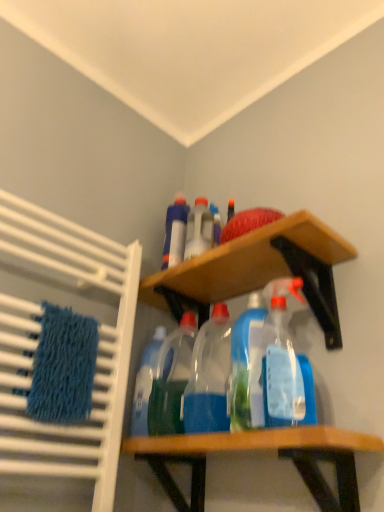
Question: Would you say wooden shelf at upper center, the second shelf from the bottom, is a long distance from translucent plastic spray bottle at center, placed as the second cleaning product when sorted from right to left?

Choices:
 (A) no
 (B) yes

Answer: (A)

Question: From the image's perspective, is wooden shelf at upper center, the 1th shelf in the top-to-bottom sequence, below translucent plastic spray bottle at center, placed as the second cleaning product when sorted from right to left?

Choices:
 (A) no
 (B) yes

Answer: (A)

Question: Is translucent plastic spray bottle at center, placed as the second cleaning product when sorted from right to left, completely or partially inside wooden shelf at upper center, the second shelf from the bottom?

Choices:
 (A) no
 (B) yes

Answer: (B)

Question: From a real-world perspective, is wooden shelf at upper center, the 1th shelf in the top-to-bottom sequence, under translucent plastic spray bottle at center, placed as the second cleaning product when sorted from right to left?

Choices:
 (A) yes
 (B) no

Answer: (B)

Question: Is wooden shelf at upper center, the 1th shelf in the top-to-bottom sequence, at the left side of translucent plastic spray bottle at center, placed as the second cleaning product when sorted from right to left?

Choices:
 (A) yes
 (B) no

Answer: (A)

Question: Looking at their shapes, would you say wooden shelf at upper center, the 1th shelf in the top-to-bottom sequence, is wider or thinner than transparent plastic bottles at center, positioned as the fourth bottle in back-to-front order?

Choices:
 (A) wide
 (B) thin

Answer: (A)

Question: Which is correct: wooden shelf at upper center, the 1th shelf in the top-to-bottom sequence, is inside transparent plastic bottles at center, which appears as the first bottle when viewed from the front, or outside of it?

Choices:
 (A) outside
 (B) inside

Answer: (A)

Question: From the image's perspective, relative to transparent plastic bottles at center, which appears as the first bottle when viewed from the front, is wooden shelf at upper center, the second shelf from the bottom, above or below?

Choices:
 (A) below
 (B) above

Answer: (B)

Question: Based on their positions, is wooden shelf at upper center, the 1th shelf in the top-to-bottom sequence, located to the left or right of transparent plastic bottles at center, which appears as the first bottle when viewed from the front?

Choices:
 (A) right
 (B) left

Answer: (A)

Question: From the image's perspective, relative to wooden shelf at center, the first shelf positioned from the bottom, is transparent plastic spray bottle at center, the first cleaning product when ordered from right to left, above or below?

Choices:
 (A) above
 (B) below

Answer: (A)

Question: In terms of height, does transparent plastic spray bottle at center, the 2th cleaning product viewed from the left, look taller or shorter compared to wooden shelf at center, acting as the 2th shelf starting from the top?

Choices:
 (A) short
 (B) tall

Answer: (B)

Question: In the image, is transparent plastic spray bottle at center, the 2th cleaning product viewed from the left, positioned in front of or behind wooden shelf at center, the first shelf positioned from the bottom?

Choices:
 (A) behind
 (B) front

Answer: (A)

Question: Does point (273, 318) appear closer or farther from the camera than point (316, 436)?

Choices:
 (A) farther
 (B) closer

Answer: (A)

Question: From their relative heights in the image, would you say transparent plastic spray bottle at center, the first cleaning product when ordered from right to left, is taller or shorter than transparent plastic bottles at center, positioned as the fourth bottle in back-to-front order?

Choices:
 (A) tall
 (B) short

Answer: (A)

Question: Relative to transparent plastic bottles at center, which appears as the first bottle when viewed from the front, is transparent plastic spray bottle at center, the first cleaning product when ordered from right to left, in front or behind?

Choices:
 (A) front
 (B) behind

Answer: (A)